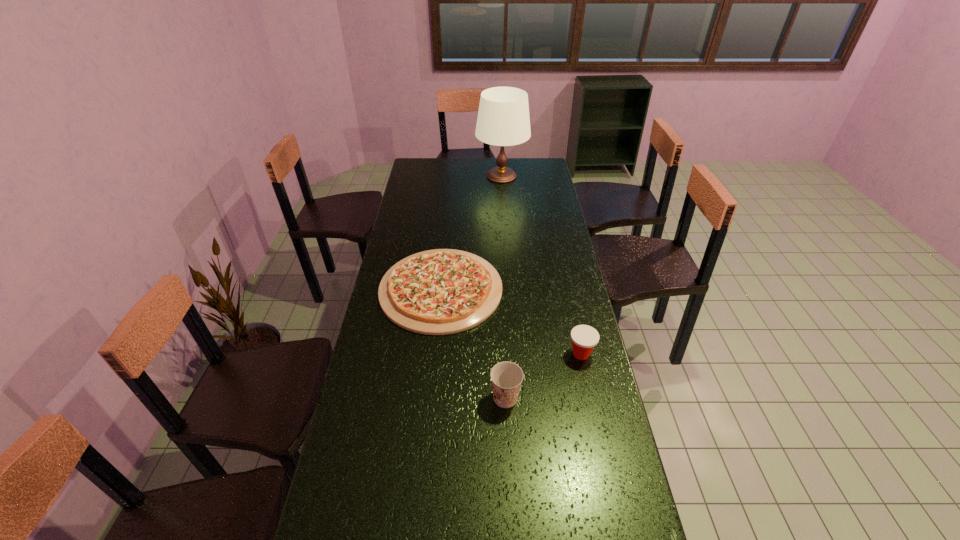
The height and width of the screenshot is (540, 960). I want to click on the farthest object, so click(503, 119).

Locate an element on the screen. The height and width of the screenshot is (540, 960). lamp is located at coordinates (503, 119).

Identify the location of the nearer Dixie cup. The image size is (960, 540). (506, 377).

You are a GUI agent. You are given a task and a screenshot of the screen. Output one action in this format:
    pyautogui.click(x=<x>, y=<y>)
    Task: Click on the taller Dixie cup
    The width and height of the screenshot is (960, 540).
    Given the screenshot: What is the action you would take?
    pyautogui.click(x=506, y=377)

The height and width of the screenshot is (540, 960). Find the location of `the shorter Dixie cup`. the shorter Dixie cup is located at coordinates (584, 338).

This screenshot has height=540, width=960. What are the coordinates of `the right Dixie cup` in the screenshot? It's located at (x=584, y=338).

Image resolution: width=960 pixels, height=540 pixels. Identify the location of the shortest object. (443, 291).

The image size is (960, 540). Find the location of `the third nearest object`. the third nearest object is located at coordinates (443, 291).

The image size is (960, 540). I want to click on free spot located 0.330m on the front of the tallest object, so click(505, 226).

This screenshot has height=540, width=960. I want to click on free space located 0.250m on the left of the left Dixie cup, so click(x=407, y=398).